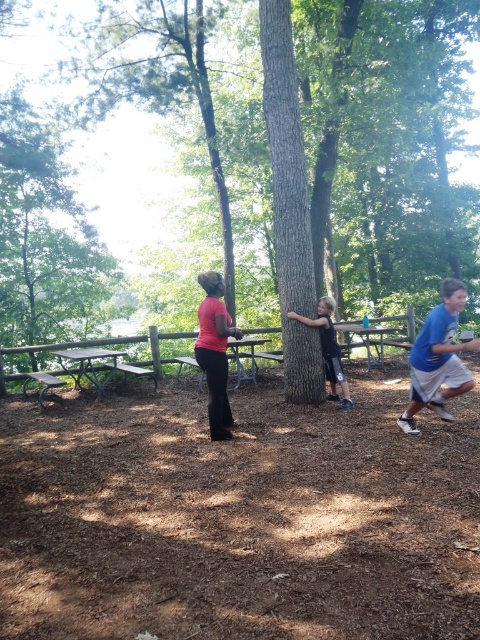
Where is `green leafy tree at upper left`? This screenshot has width=480, height=640. green leafy tree at upper left is located at coordinates (46, 240).

Identify the location of green leafy tree at upper left. The width and height of the screenshot is (480, 640). (46, 240).

The height and width of the screenshot is (640, 480). I want to click on green leafy tree at upper left, so click(46, 240).

Is point (330, 330) closer to camera compared to point (71, 353)?

Yes, point (330, 330) is closer to viewer.

Is black matte shirt at center below metallic silver picnic table at lower left?

Actually, black matte shirt at center is above metallic silver picnic table at lower left.

Does point (332, 371) come in front of point (97, 390)?

Yes.

Identify the location of black matte shirt at center. The width and height of the screenshot is (480, 640). (327, 349).

Who is higher up, green leafy tree at upper left or black matte shirt at center?

green leafy tree at upper left is above.

Is green leafy tree at upper left smaller than black matte shirt at center?

Correct, green leafy tree at upper left occupies less space than black matte shirt at center.

The image size is (480, 640). What do you see at coordinates (46, 240) in the screenshot?
I see `green leafy tree at upper left` at bounding box center [46, 240].

Where is `green leafy tree at upper left`? The height and width of the screenshot is (640, 480). green leafy tree at upper left is located at coordinates (46, 240).